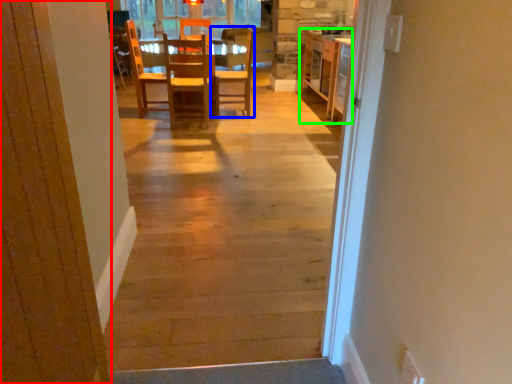
Question: Which is nearer to the door (highlighted by a red box)? chair (highlighted by a blue box) or cabinetry (highlighted by a green box).

Choices:
 (A) chair
 (B) cabinetry

Answer: (A)